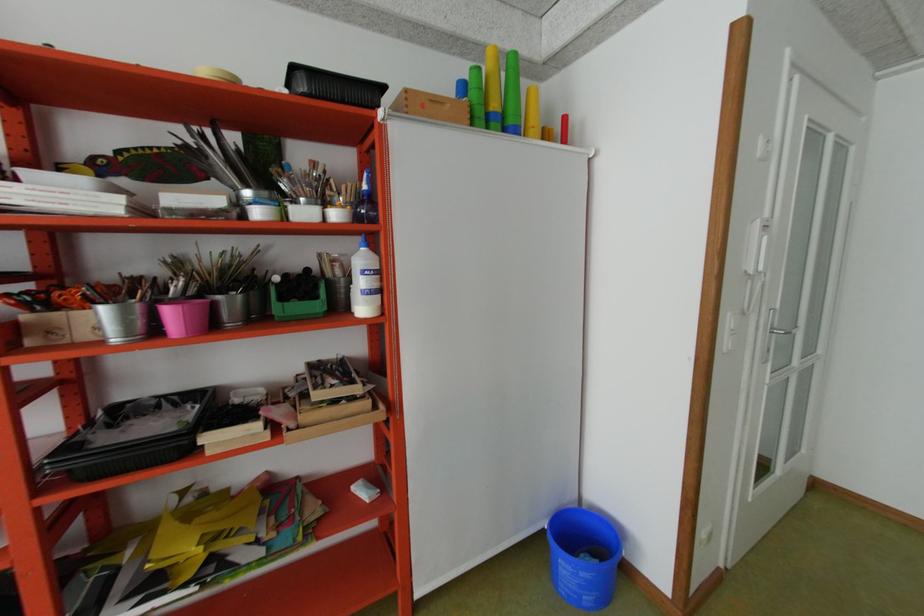
Find the location of `orange scissors handles`. orange scissors handles is located at coordinates (91, 294).